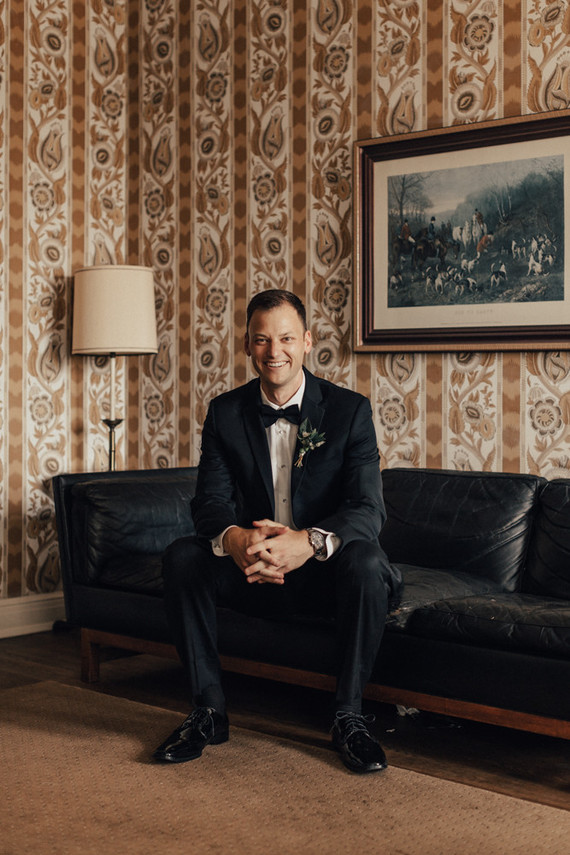
You are a GUI agent. You are given a task and a screenshot of the screen. Output one action in this format:
    pyautogui.click(x=<x>, y=<y>)
    Task: Click on the black leather couch
    
    Given the screenshot: What is the action you would take?
    pyautogui.click(x=431, y=581)